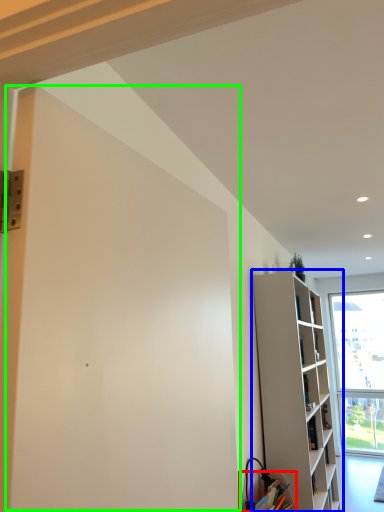
Question: Which is farther away from cabinetry (highlighted by a red box)? shelf (highlighted by a blue box) or screen door (highlighted by a green box)?

Choices:
 (A) shelf
 (B) screen door

Answer: (B)